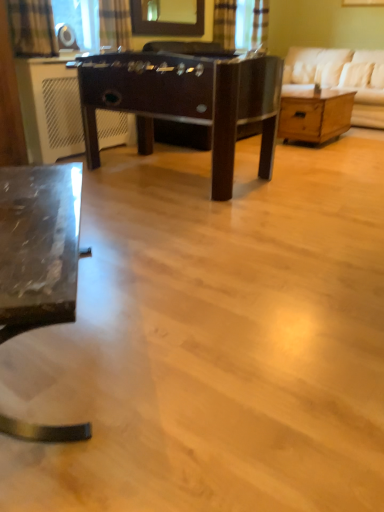
This screenshot has height=512, width=384. I want to click on free space in front of wooden drawer at right, which is the second table from left to right, so click(x=324, y=157).